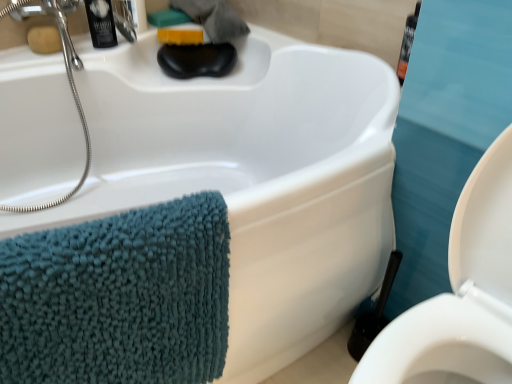
You are a GUI agent. You are given a task and a screenshot of the screen. Output one action in this format:
    pyautogui.click(x=<x>, y=<y>)
    Task: Click on the yellow sponge at upper center, which is counted as the second soap, starting from the left
    Image resolution: width=512 pixels, height=384 pixels.
    Given the screenshot: What is the action you would take?
    pyautogui.click(x=181, y=35)

Locate an element on the screen. The height and width of the screenshot is (384, 512). satin nickel faucet at upper left is located at coordinates (124, 19).

Describe the element at coordinates (373, 313) in the screenshot. I see `black plastic toilet brush at lower right` at that location.

Measure the distance between point (147, 335) and camera.

Point (147, 335) and camera are 28.70 inches apart.

This screenshot has height=384, width=512. What are the coordinates of `black plastic toiletry at upper left` in the screenshot? It's located at (101, 23).

Could you tell me if black plastic toiletry at upper left is turned towards black plastic toilet brush at lower right?

Yes.

Which of these two, black plastic toiletry at upper left or black plastic toilet brush at lower right, stands shorter?

Standing shorter between the two is black plastic toiletry at upper left.

In terms of size, does black plastic toiletry at upper left appear bigger or smaller than black plastic toilet brush at lower right?

Considering their sizes, black plastic toiletry at upper left takes up less space than black plastic toilet brush at lower right.

Is black plastic toiletry at upper left completely or partially outside of black plastic toilet brush at lower right?

Absolutely, black plastic toiletry at upper left is external to black plastic toilet brush at lower right.

Measure the distance between matte brown soap at upper left, which is counted as the 2th soap, starting from the right, and white glossy toilet at lower right.

matte brown soap at upper left, which is counted as the 2th soap, starting from the right, is 4.39 feet from white glossy toilet at lower right.

Is matte brown soap at upper left, the 2th soap in the back-to-front sequence, far away from white glossy toilet at lower right?

matte brown soap at upper left, the 2th soap in the back-to-front sequence, is positioned a significant distance from white glossy toilet at lower right.

Between matte brown soap at upper left, which ranks as the first soap in front-to-back order, and white glossy toilet at lower right, which one appears on the right side from the viewer's perspective?

white glossy toilet at lower right is more to the right.

Considering the positions of points (39, 26) and (459, 370), is point (39, 26) closer to camera compared to point (459, 370)?

No, it is behind (459, 370).

Is teal chenille towel at left far from matte brown soap at upper left, which is counted as the 2th soap, starting from the right?

Yes, teal chenille towel at left and matte brown soap at upper left, which is counted as the 2th soap, starting from the right, are quite far apart.

Which of these two, teal chenille towel at left or matte brown soap at upper left, the first soap when ordered from left to right, stands taller?

teal chenille towel at left is taller.

Does teal chenille towel at left have a greater width compared to matte brown soap at upper left, the 2th soap in the back-to-front sequence?

Indeed, teal chenille towel at left has a greater width compared to matte brown soap at upper left, the 2th soap in the back-to-front sequence.

Is teal chenille towel at left facing towards matte brown soap at upper left, which ranks as the first soap in front-to-back order?

No, teal chenille towel at left does not turn towards matte brown soap at upper left, which ranks as the first soap in front-to-back order.

Relative to black plastic toiletry at upper left, is matte brown soap at upper left, the 2th soap in the back-to-front sequence, in front or behind?

In the image, matte brown soap at upper left, the 2th soap in the back-to-front sequence, appears behind black plastic toiletry at upper left.

Is black plastic toiletry at upper left at the back of matte brown soap at upper left, the first soap when ordered from left to right?

No, matte brown soap at upper left, the first soap when ordered from left to right, is not facing the opposite direction of black plastic toiletry at upper left.

Identify the location of toiletry that is above the matte brown soap at upper left, the first soap when ordered from left to right (from the image's perspective). The height and width of the screenshot is (384, 512). [x=101, y=23].

Considering the positions of point (55, 47) and point (106, 32), is point (55, 47) closer or farther from the camera than point (106, 32)?

Point (55, 47) is positioned closer to the camera compared to point (106, 32).

Are satin nickel faucet at upper left and teal chenille towel at left making contact?

No, satin nickel faucet at upper left is not making contact with teal chenille towel at left.

From the image's perspective, which one is positioned lower, satin nickel faucet at upper left or teal chenille towel at left?

teal chenille towel at left appears lower in the image.

What's the angular difference between satin nickel faucet at upper left and teal chenille towel at left's facing directions?

They differ by 25.1 degrees in their facing directions.

Looking at their sizes, would you say matte brown soap at upper left, which ranks as the first soap in front-to-back order, is wider or thinner than satin nickel faucet at upper left?

Considering their sizes, matte brown soap at upper left, which ranks as the first soap in front-to-back order, looks slimmer than satin nickel faucet at upper left.

Is matte brown soap at upper left, which is counted as the 2th soap, starting from the right, in front of or behind satin nickel faucet at upper left in the image?

In the image, matte brown soap at upper left, which is counted as the 2th soap, starting from the right, appears in front of satin nickel faucet at upper left.

From a real-world perspective, between matte brown soap at upper left, the first soap when ordered from left to right, and satin nickel faucet at upper left, who is vertically lower?

matte brown soap at upper left, the first soap when ordered from left to right, is physically lower.

Considering the relative sizes of matte brown soap at upper left, which ranks as the first soap in front-to-back order, and black plastic toilet brush at lower right in the image provided, is matte brown soap at upper left, which ranks as the first soap in front-to-back order, thinner than black plastic toilet brush at lower right?

Yes.

Is matte brown soap at upper left, the 2th soap in the back-to-front sequence, at the left side of black plastic toilet brush at lower right?

Yes.

Is matte brown soap at upper left, which is counted as the 2th soap, starting from the right, positioned far away from black plastic toilet brush at lower right?

Absolutely, matte brown soap at upper left, which is counted as the 2th soap, starting from the right, is distant from black plastic toilet brush at lower right.

Could you tell me if matte brown soap at upper left, the 2th soap in the back-to-front sequence, is turned towards black plastic toilet brush at lower right?

Yes, matte brown soap at upper left, the 2th soap in the back-to-front sequence, is turned towards black plastic toilet brush at lower right.

The image size is (512, 384). Find the location of `brush directly beneath the black plastic toiletry at upper left (from a real-world perspective)`. brush directly beneath the black plastic toiletry at upper left (from a real-world perspective) is located at coordinates (373, 313).

Where is `toilet that is below the matte brown soap at upper left, the 2th soap in the back-to-front sequence (from the image's perspective)`? The image size is (512, 384). toilet that is below the matte brown soap at upper left, the 2th soap in the back-to-front sequence (from the image's perspective) is located at coordinates (460, 294).

Estimate the real-world distances between objects in this image. Which object is further from yellow sponge at upper center, which ranks as the 1th soap in right-to-left order, teal chenille towel at left or satin nickel faucet at upper left?

The object further to yellow sponge at upper center, which ranks as the 1th soap in right-to-left order, is teal chenille towel at left.

Considering their positions, is black plastic toiletry at upper left positioned further to matte brown soap at upper left, which is counted as the 2th soap, starting from the right, than yellow sponge at upper center, which ranks as the 1th soap in right-to-left order?

Among the two, yellow sponge at upper center, which ranks as the 1th soap in right-to-left order, is located further to matte brown soap at upper left, which is counted as the 2th soap, starting from the right.

From the image, which object appears to be farther from white glossy toilet at lower right, black plastic toiletry at upper left or black plastic toilet brush at lower right?

black plastic toiletry at upper left lies further to white glossy toilet at lower right than the other object.

Based on their spatial positions, is white glossy toilet at lower right or teal chenille towel at left further from black plastic toilet brush at lower right?

teal chenille towel at left lies further to black plastic toilet brush at lower right than the other object.

Looking at the image, which one is located further to black plastic toiletry at upper left, matte brown soap at upper left, which is counted as the 2th soap, starting from the right, or yellow sponge at upper center, which is counted as the second soap, starting from the left?

Based on the image, yellow sponge at upper center, which is counted as the second soap, starting from the left, appears to be further to black plastic toiletry at upper left.

Considering their positions, is satin nickel faucet at upper left positioned further to teal chenille towel at left than matte brown soap at upper left, which ranks as the first soap in front-to-back order?

satin nickel faucet at upper left.

Which object lies further to the anchor point black plastic toiletry at upper left, yellow sponge at upper center, which is the first soap from back to front, or teal chenille towel at left?

teal chenille towel at left is positioned further to the anchor black plastic toiletry at upper left.

Based on the photo, from the image, which object appears to be farther from satin nickel faucet at upper left, black plastic toiletry at upper left or white glossy toilet at lower right?

white glossy toilet at lower right is further to satin nickel faucet at upper left.

The height and width of the screenshot is (384, 512). What are the coordinates of `faucet positioned between white glossy toilet at lower right and yellow sponge at upper center, which is counted as the second soap, starting from the left, from near to far` in the screenshot? It's located at (124, 19).

Identify the location of bath towel positioned between white glossy toilet at lower right and satin nickel faucet at upper left from near to far. This screenshot has height=384, width=512. (119, 297).

Locate an element on the screen. The height and width of the screenshot is (384, 512). bath towel between white glossy toilet at lower right and black plastic toilet brush at lower right from front to back is located at coordinates (119, 297).

Where is `toiletry between white glossy toilet at lower right and satin nickel faucet at upper left along the z-axis`? Image resolution: width=512 pixels, height=384 pixels. toiletry between white glossy toilet at lower right and satin nickel faucet at upper left along the z-axis is located at coordinates tap(101, 23).